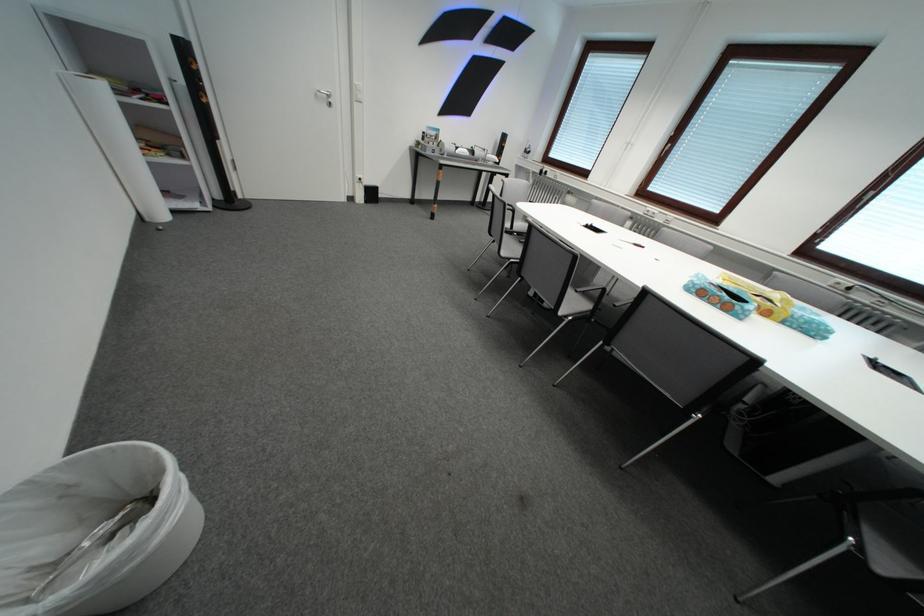
Find the location of a particular element. The image size is (924, 616). black floor speaker is located at coordinates (205, 123).